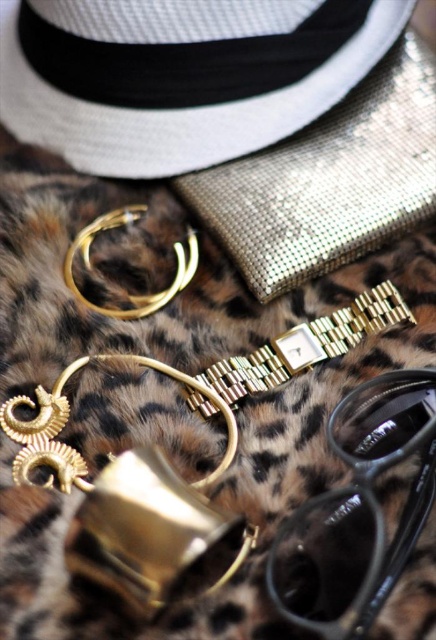
Who is lower down, white woven hat at upper left or black plastic goggles at lower right?

black plastic goggles at lower right

Who is higher up, white woven hat at upper left or black plastic goggles at lower right?

white woven hat at upper left

Where is `white woven hat at upper left`? The width and height of the screenshot is (436, 640). white woven hat at upper left is located at coordinates (181, 74).

You are a GUI agent. You are given a task and a screenshot of the screen. Output one action in this format:
    pyautogui.click(x=<x>, y=<y>)
    Task: Click on the white woven hat at upper left
    
    Given the screenshot: What is the action you would take?
    pyautogui.click(x=181, y=74)